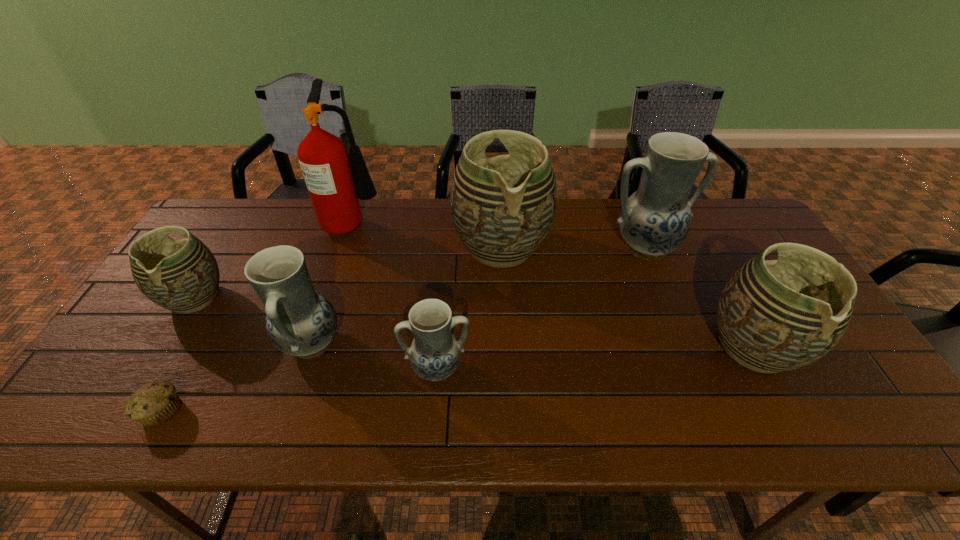
At what (x,y) coordinates should I click in order to perform the action: click on the leftmost brown pottery. Please return your answer as a coordinate pair (x, y). The height and width of the screenshot is (540, 960). Looking at the image, I should click on (183, 276).

Locate an element on the screen. This screenshot has width=960, height=540. muffin is located at coordinates (155, 403).

Identify the location of the shortest object. (155, 403).

This screenshot has height=540, width=960. Identify the location of free space located 0.230m at the nozzle of the red fire extinguisher. [x=453, y=222].

At what (x,y) coordinates should I click in order to perform the action: click on vacant space located 0.260m on the left of the farthest blue pottery. Please return your answer as a coordinate pair (x, y). The width and height of the screenshot is (960, 540). Looking at the image, I should click on pyautogui.click(x=519, y=247).

The width and height of the screenshot is (960, 540). What are the coordinates of `free space located on the front of the biggest brown pottery` in the screenshot? It's located at (507, 364).

Locate an element on the screen. This screenshot has height=540, width=960. blank space located 0.120m on the left of the second biggest brown pottery is located at coordinates (658, 347).

Find the location of a particular element. The image size is (960, 540). vacant space situated 0.190m on the back of the second pottery from left to right is located at coordinates [338, 263].

I want to click on vacant space situated on the left of the smallest blue pottery, so click(383, 369).

In order to click on vacant space located on the back of the smallest brown pottery in this screenshot , I will do `click(238, 227)`.